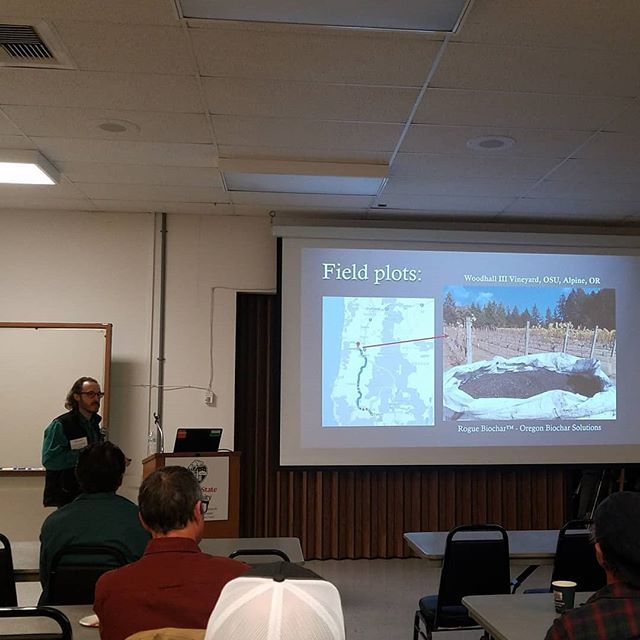
I want to click on curtain or screen, so click(363, 529).